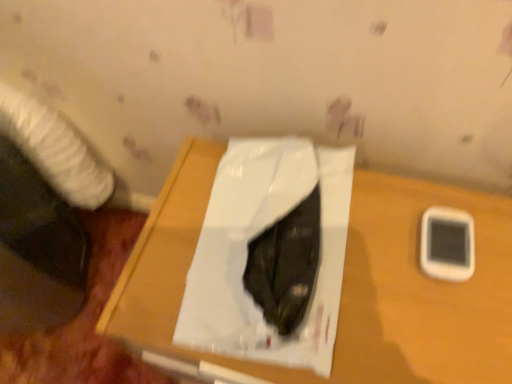
Locate an element on the screen. free spot above wooden table at center (from a real-world perspective) is located at coordinates (342, 269).